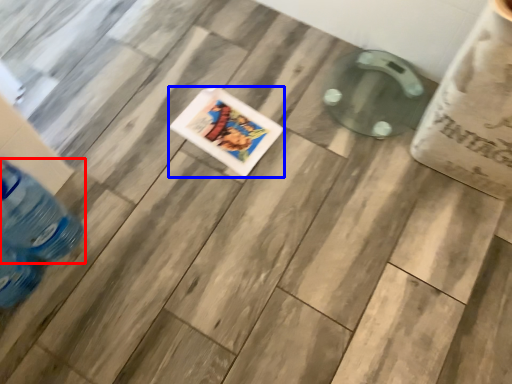
Question: Which point is further to the camera, bottle (highlighted by a red box) or comic book (highlighted by a blue box)?

Choices:
 (A) bottle
 (B) comic book

Answer: (B)